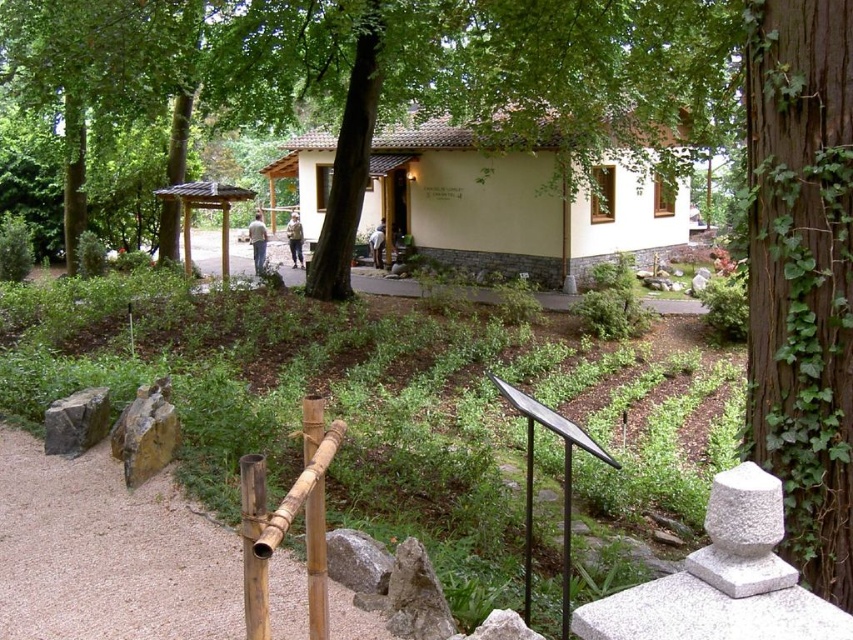
Question: Can you confirm if rusty metallic rock at lower left is positioned above bamboo rail at lower center?

Choices:
 (A) no
 (B) yes

Answer: (A)

Question: Observing the image, what is the correct spatial positioning of brown gravel path at center in reference to gray rough rock at lower center?

Choices:
 (A) left
 (B) right

Answer: (A)

Question: Which point is farther to the camera?

Choices:
 (A) (241, 273)
 (B) (776, 244)
 (C) (4, 49)

Answer: (A)

Question: Estimate the real-world distances between objects in this image. Which object is farther from the rusty metallic rock at lower left?

Choices:
 (A) gray rough rock at lower center
 (B) brown gravel path at center
 (C) green ivy-covered tree at right
 (D) gray rough stone at lower left

Answer: (B)

Question: Does green leafy tree at center have a smaller size compared to rusty metallic rock at lower left?

Choices:
 (A) no
 (B) yes

Answer: (A)

Question: Which object is closer to the camera taking this photo?

Choices:
 (A) brown gravel path at center
 (B) green leafy tree at center
 (C) gray rough stone at lower left

Answer: (C)